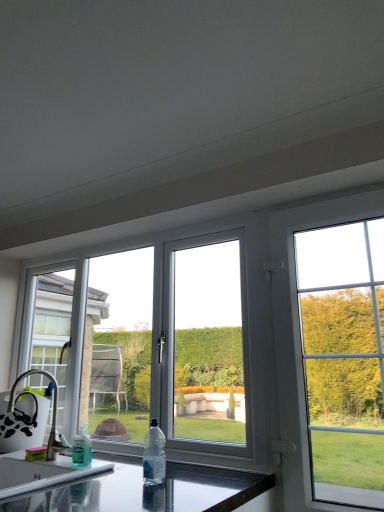
At what (x,y) coordinates should I click in order to perform the action: click on vacant space in front of clear plastic bottle at lower left, the second bottle viewed from the front. Please return your answer as a coordinate pair (x, y). Image resolution: width=384 pixels, height=512 pixels. Looking at the image, I should click on (64, 471).